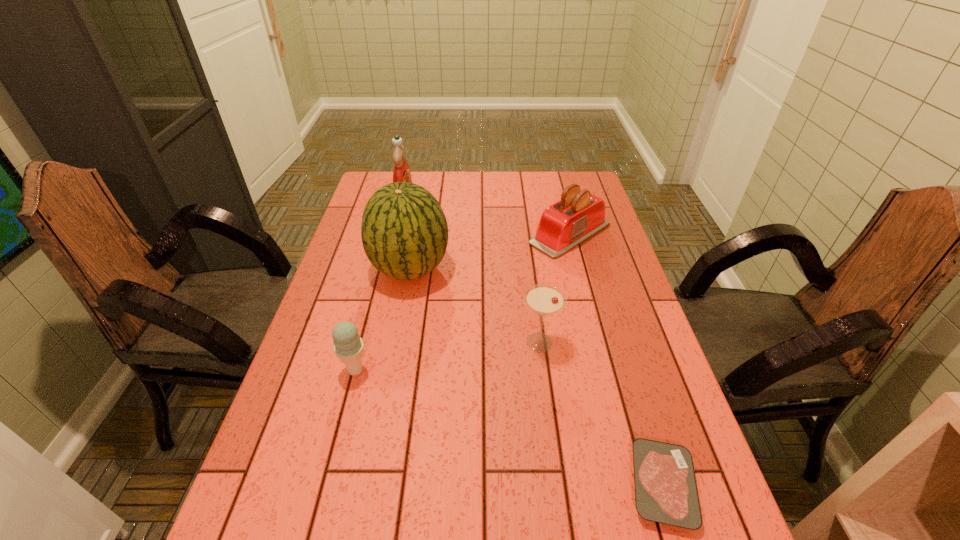
Where is `free spot between the nearest object and the toaster`? This screenshot has width=960, height=540. free spot between the nearest object and the toaster is located at coordinates (616, 360).

Identify the location of free space between the steak and the toaster. The height and width of the screenshot is (540, 960). (616, 360).

This screenshot has width=960, height=540. In order to click on object that is the nearest to the shortest object in this screenshot , I will do `click(544, 299)`.

Select which object is the second closest to the second nearest object. Please provide its 2D coordinates. Your answer should be formatted as a tuple, i.e. [(x, y)], where the tuple contains the x and y coordinates of a point satisfying the conditions above.

[(544, 299)]

Locate an element on the screen. free location that satisfies the following two spatial constraints: 1. on the front surface of the detergent; 2. on the left side of the toaster is located at coordinates (397, 234).

Locate an element on the screen. This screenshot has height=540, width=960. vacant area that satisfies the following two spatial constraints: 1. on the back side of the martini; 2. on the front surface of the detergent is located at coordinates (521, 202).

Locate an element on the screen. vacant space that satisfies the following two spatial constraints: 1. on the front side of the toaster; 2. on the left side of the shortest object is located at coordinates (636, 485).

Where is `free space that satisfies the following two spatial constraints: 1. on the front surface of the detergent; 2. on the back side of the third nearest object`? free space that satisfies the following two spatial constraints: 1. on the front surface of the detergent; 2. on the back side of the third nearest object is located at coordinates (372, 342).

This screenshot has height=540, width=960. What are the coordinates of `free space that satisfies the following two spatial constraints: 1. on the front surface of the toaster; 2. on the right side of the detergent` in the screenshot? It's located at (397, 234).

Image resolution: width=960 pixels, height=540 pixels. Identify the location of free spot that satisfies the following two spatial constraints: 1. on the front surface of the toaster; 2. on the right side of the detergent. (397, 234).